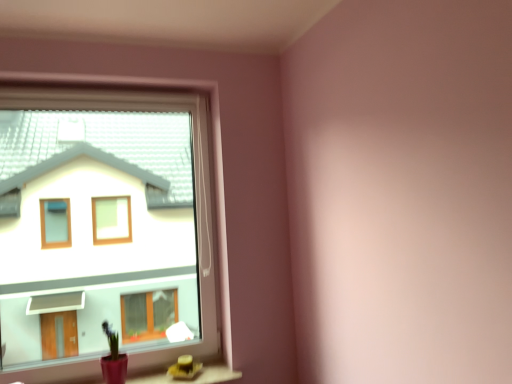
Image resolution: width=512 pixels, height=384 pixels. I want to click on free space above transparent plastic window at upper left (from a real-world perspective), so pyautogui.click(x=108, y=93).